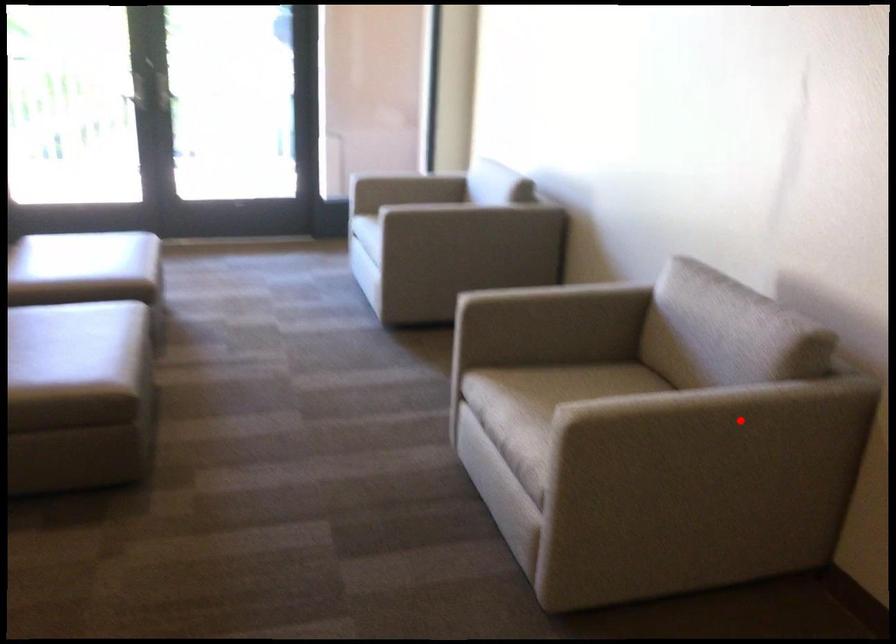
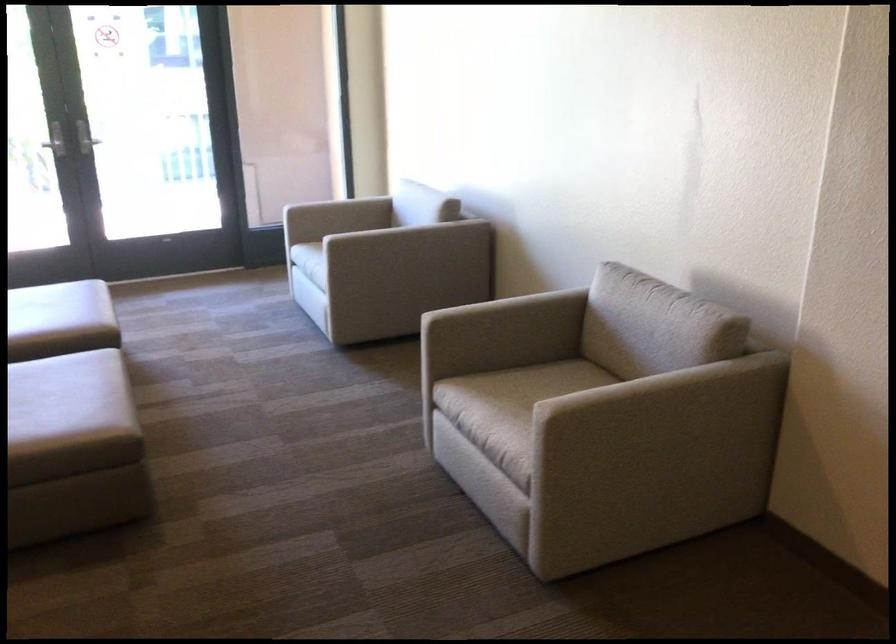
Question: I am providing you with two images of the same scene from different viewpoints. Image1 has a red point marked. In image2, the corresponding 3D location appears at what relative position? Reply with the corresponding letter.

Choices:
 (A) Closer
 (B) Farther

Answer: (B)